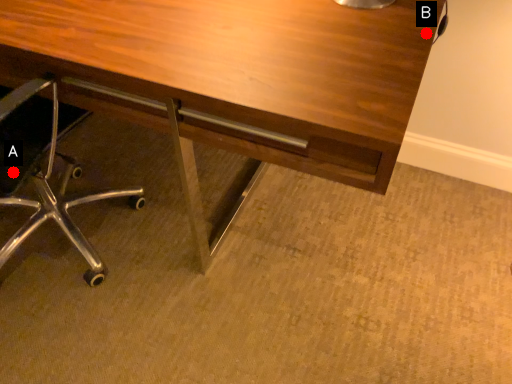
Question: Two points are circled on the image, labeled by A and B beside each circle. Which point is farther from the camera taking this photo?

Choices:
 (A) A is further
 (B) B is further

Answer: (A)